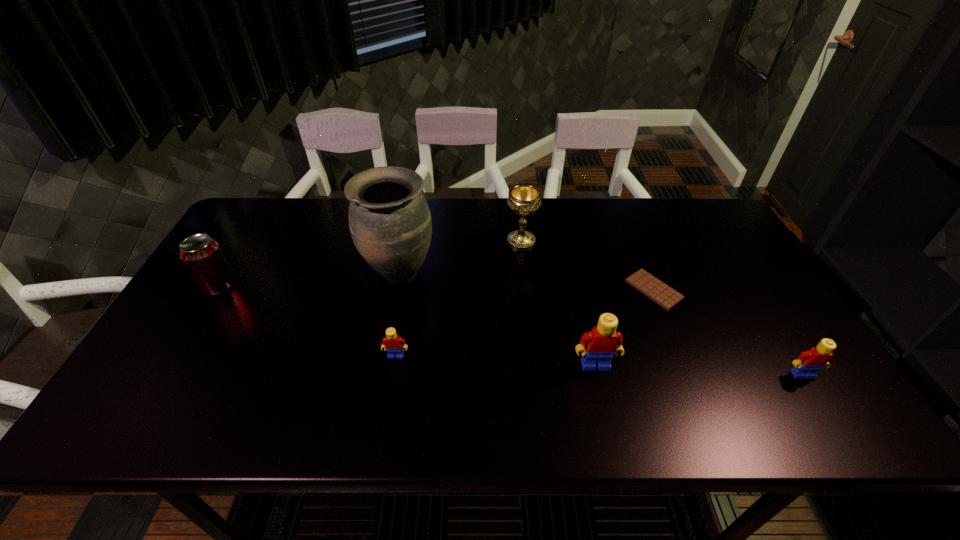
This screenshot has height=540, width=960. In order to click on the shortest object in this screenshot , I will do `click(665, 296)`.

Locate an element on the screen. free space located 0.090m on the face of the sixth tallest object is located at coordinates (390, 393).

At what (x,y) coordinates should I click in order to perform the action: click on blank area located 0.320m on the left of the fourth object from left to right. Please return your answer as a coordinate pair (x, y). Looking at the image, I should click on (403, 241).

I want to click on vacant space located on the back of the soda can, so click(239, 251).

At what (x,y) coordinates should I click in order to perform the action: click on free space located on the front of the urn. Please return your answer as a coordinate pair (x, y). This screenshot has height=540, width=960. Looking at the image, I should click on (383, 357).

You are a GUI agent. You are given a task and a screenshot of the screen. Output one action in this format:
    pyautogui.click(x=<x>, y=<y>)
    Task: Click on the free space located 0.240m on the left of the sixth object from left to right
    This screenshot has height=540, width=960.
    Given the screenshot: What is the action you would take?
    pyautogui.click(x=541, y=289)

Find the location of a particular element. object located at the far edge is located at coordinates (524, 199).

At what (x,y) coordinates should I click in order to perform the action: click on object positioned at the left edge. Please return your answer as a coordinate pair (x, y). Looking at the image, I should click on (202, 255).

This screenshot has width=960, height=540. In order to click on object located in the right edge section of the desktop in this screenshot , I will do `click(809, 362)`.

Locate an element on the screen. This screenshot has width=960, height=540. object situated at the near right corner is located at coordinates click(809, 362).